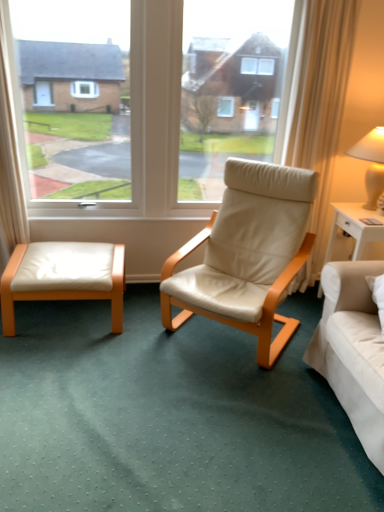
The width and height of the screenshot is (384, 512). I want to click on free point below beige leather chair at center (from a real-world perspective), so click(216, 337).